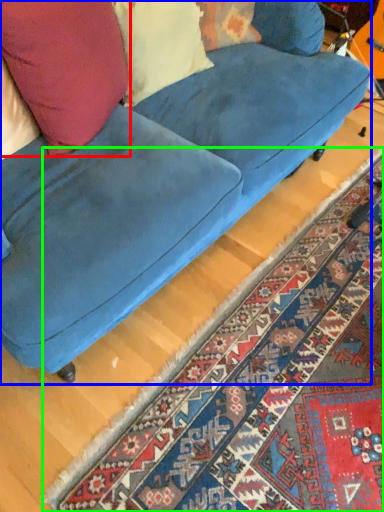
Question: Based on their relative distances, which object is farther from throw pillow (highlighted by a red box)? Choose from studio couch (highlighted by a blue box) and mat (highlighted by a green box).

Choices:
 (A) studio couch
 (B) mat

Answer: (B)